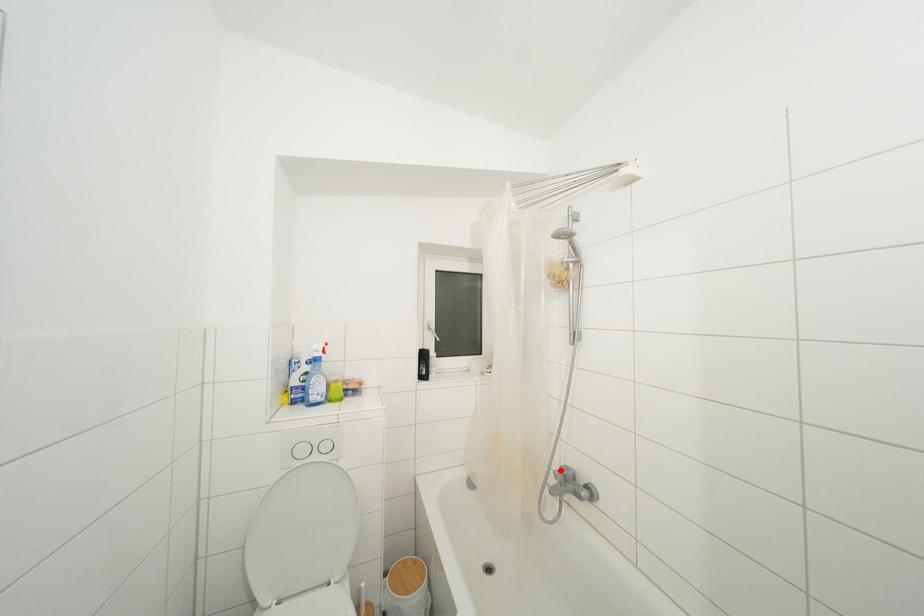
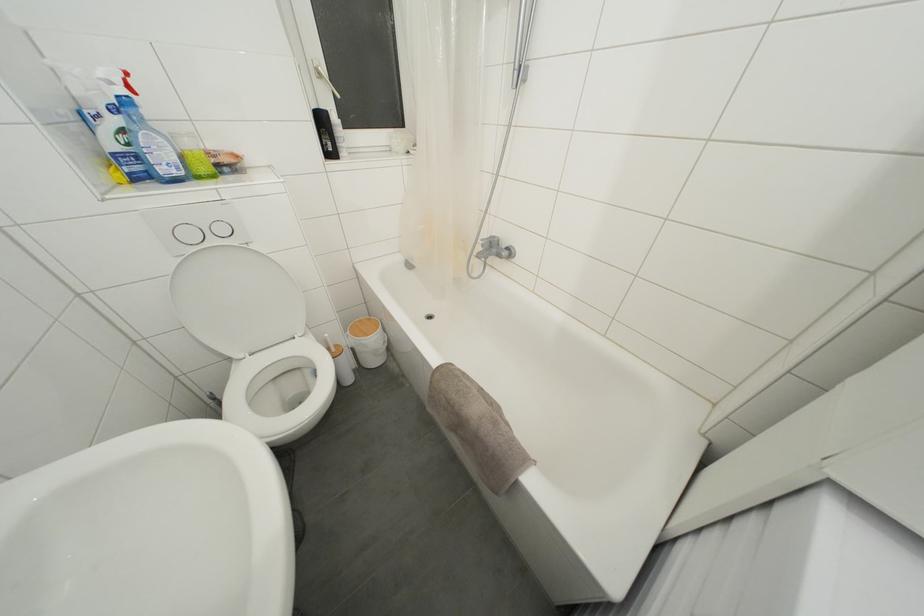
Where in the second image is the point corresponding to the highlighted location from the first image?

(488, 240)